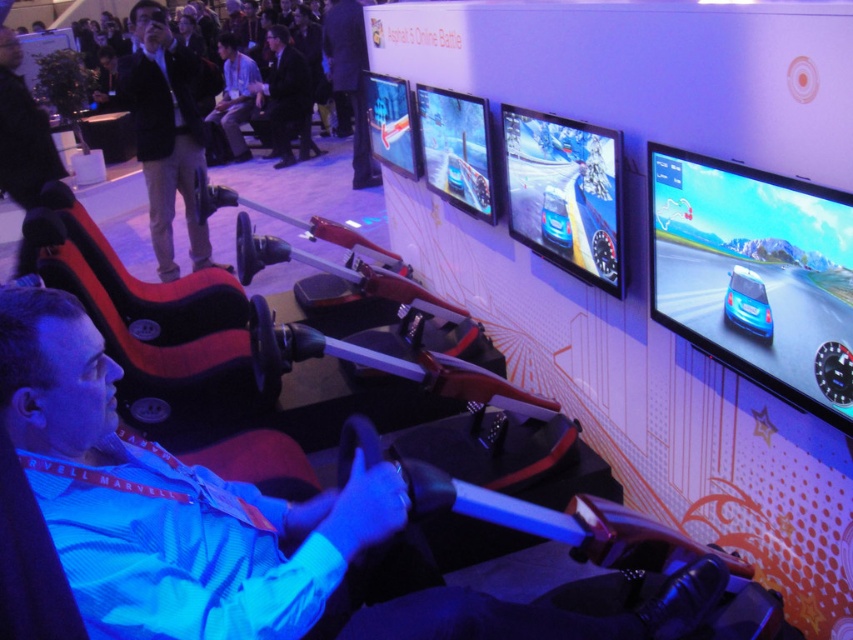
You are standing in front of the racing simulator setup. There are two points marked on the simulator. The first point is at coordinate point (280, 138) and the second point is at coordinate point (747, 275). Which point is closer to you?

Point (280, 138) is closer to you because it is further to the viewer than point (747, 275).

You are standing at the entrance of the gaming event and want to take a photo of the racing simulator setup. The two points marked in the image are part of the simulator. Which point, point (379, 528) or point (175, 92), is closer to you?

Point (379, 528) is closer to the viewer than point (175, 92).